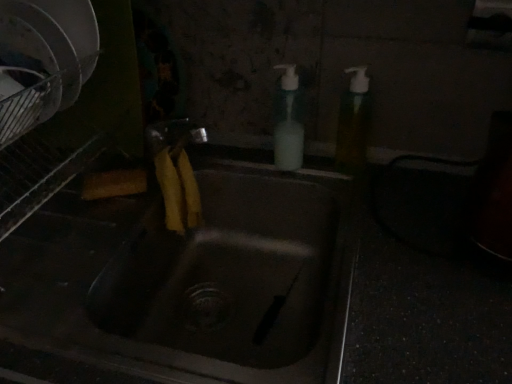
Question: From the image's perspective, is matte stainless steel sink at center above translucent plastic soap dispenser at upper right, marked as the 1th soap dispenser in a right-to-left arrangement?

Choices:
 (A) yes
 (B) no

Answer: (B)

Question: Can you confirm if matte stainless steel sink at center is thinner than translucent plastic soap dispenser at upper right, which appears as the second soap dispenser when viewed from the left?

Choices:
 (A) no
 (B) yes

Answer: (A)

Question: Could you tell me if matte stainless steel sink at center is facing translucent plastic soap dispenser at upper right, which appears as the second soap dispenser when viewed from the left?

Choices:
 (A) yes
 (B) no

Answer: (B)

Question: Considering the relative sizes of matte stainless steel sink at center and translucent plastic soap dispenser at upper right, which appears as the second soap dispenser when viewed from the left, in the image provided, is matte stainless steel sink at center wider than translucent plastic soap dispenser at upper right, which appears as the second soap dispenser when viewed from the left,?

Choices:
 (A) no
 (B) yes

Answer: (B)

Question: Is matte stainless steel sink at center directly adjacent to translucent plastic soap dispenser at upper right, marked as the 1th soap dispenser in a right-to-left arrangement?

Choices:
 (A) yes
 (B) no

Answer: (B)

Question: Is matte stainless steel sink at center looking in the opposite direction of translucent plastic soap dispenser at upper right, marked as the 1th soap dispenser in a right-to-left arrangement?

Choices:
 (A) yes
 (B) no

Answer: (B)

Question: Does matte stainless steel sink at center come in front of white plastic soap dispenser at upper center, arranged as the 1th soap dispenser when viewed from the left?

Choices:
 (A) yes
 (B) no

Answer: (A)

Question: From the image's perspective, is matte stainless steel sink at center beneath white plastic soap dispenser at upper center, arranged as the 1th soap dispenser when viewed from the left?

Choices:
 (A) no
 (B) yes

Answer: (B)

Question: Can you confirm if matte stainless steel sink at center is shorter than white plastic soap dispenser at upper center, arranged as the 1th soap dispenser when viewed from the left?

Choices:
 (A) no
 (B) yes

Answer: (A)

Question: Does matte stainless steel sink at center have a smaller size compared to white plastic soap dispenser at upper center, arranged as the 1th soap dispenser when viewed from the left?

Choices:
 (A) yes
 (B) no

Answer: (B)

Question: Is matte stainless steel sink at center at the right side of white plastic soap dispenser at upper center, arranged as the 1th soap dispenser when viewed from the left?

Choices:
 (A) yes
 (B) no

Answer: (B)

Question: Is matte stainless steel sink at center positioned beyond the bounds of white plastic soap dispenser at upper center, which appears as the 2th soap dispenser when viewed from the right?

Choices:
 (A) yes
 (B) no

Answer: (A)

Question: Can you confirm if translucent plastic soap dispenser at upper right, which appears as the second soap dispenser when viewed from the left, is positioned to the right of matte stainless steel sink at center?

Choices:
 (A) no
 (B) yes

Answer: (B)